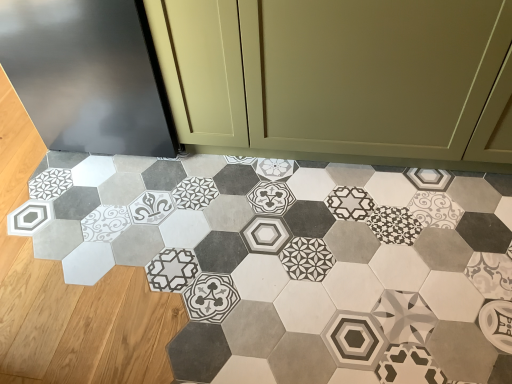
Identify the location of free spot above patterned hexagonal tile at center (from a real-world perspective). This screenshot has width=512, height=384. (236, 283).